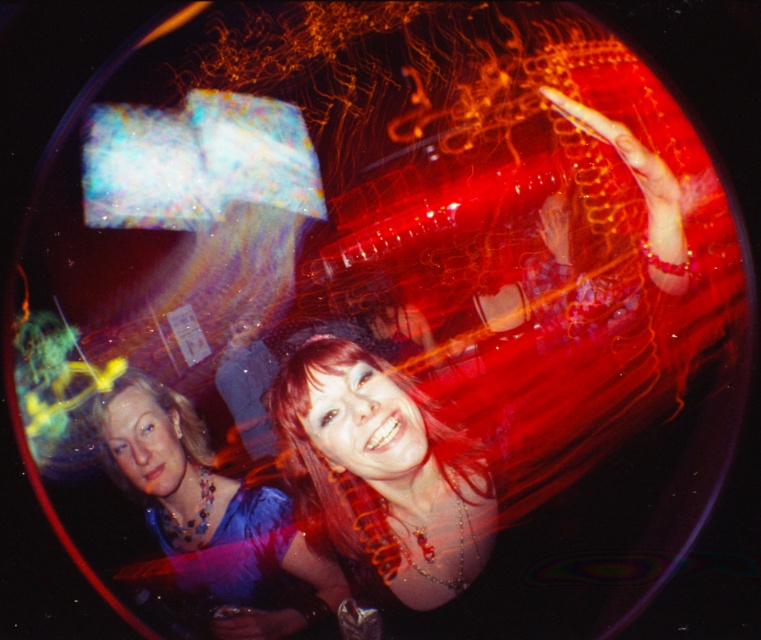
Question: Which object is farther from the camera taking this photo?

Choices:
 (A) shiny blue dress at lower left
 (B) shiny red hair at center

Answer: (A)

Question: From the image, what is the correct spatial relationship of shiny red hair at center in relation to shiny blue dress at lower left?

Choices:
 (A) above
 (B) below

Answer: (A)

Question: Does shiny red hair at center have a larger size compared to shiny blue dress at lower left?

Choices:
 (A) no
 (B) yes

Answer: (A)

Question: Is shiny red hair at center smaller than shiny blue dress at lower left?

Choices:
 (A) yes
 (B) no

Answer: (A)